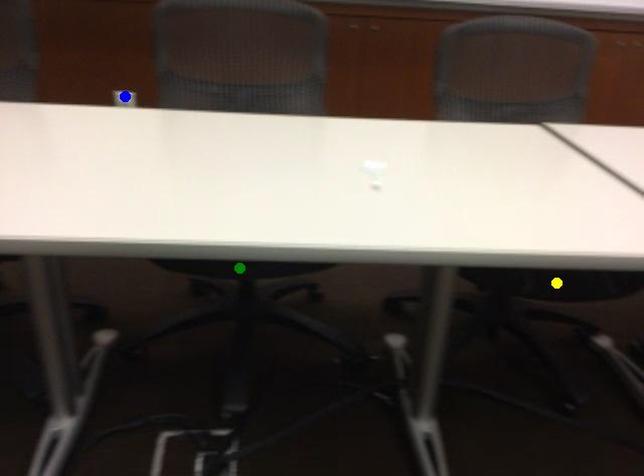
Order these from nearest to farthest:
- blue point
- yellow point
- green point

yellow point
green point
blue point